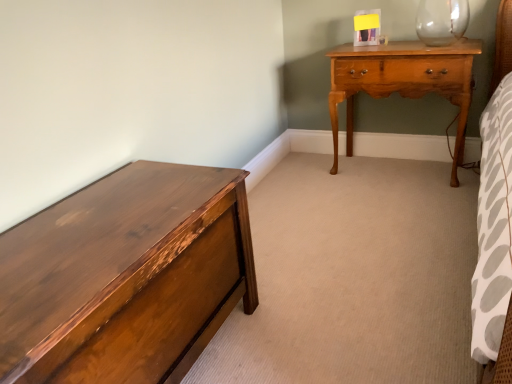
I want to click on free space below light brown wood nightstand at upper right (from a real-world perspective), so click(x=394, y=168).